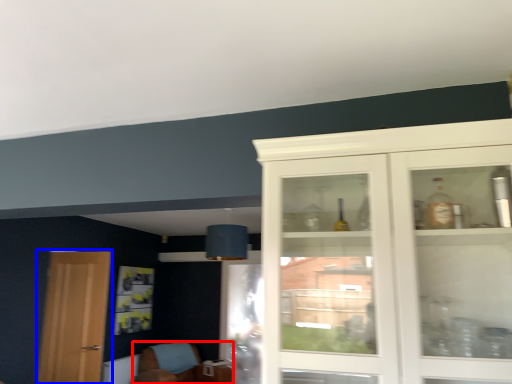
Question: Which object is closer to the camera taking this photo, chair (highlighted by a red box) or door (highlighted by a blue box)?

Choices:
 (A) chair
 (B) door

Answer: (B)